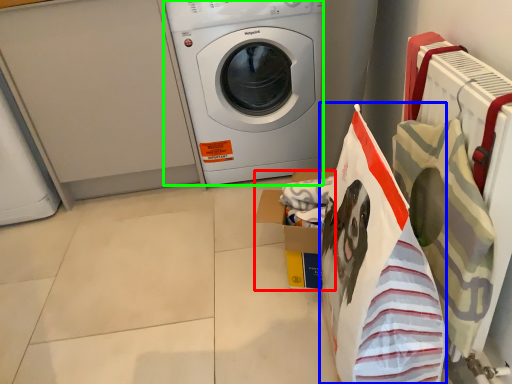
Question: Considering the real-world distances, which object is closest to cardboard box (highlighted by a red box)? shopping bag (highlighted by a blue box) or washing machine (highlighted by a green box).

Choices:
 (A) shopping bag
 (B) washing machine

Answer: (A)